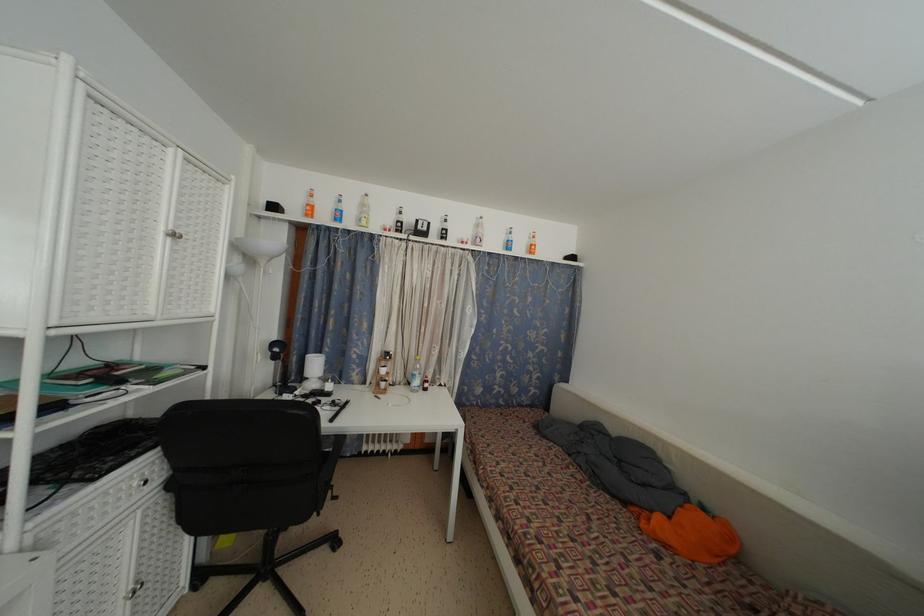
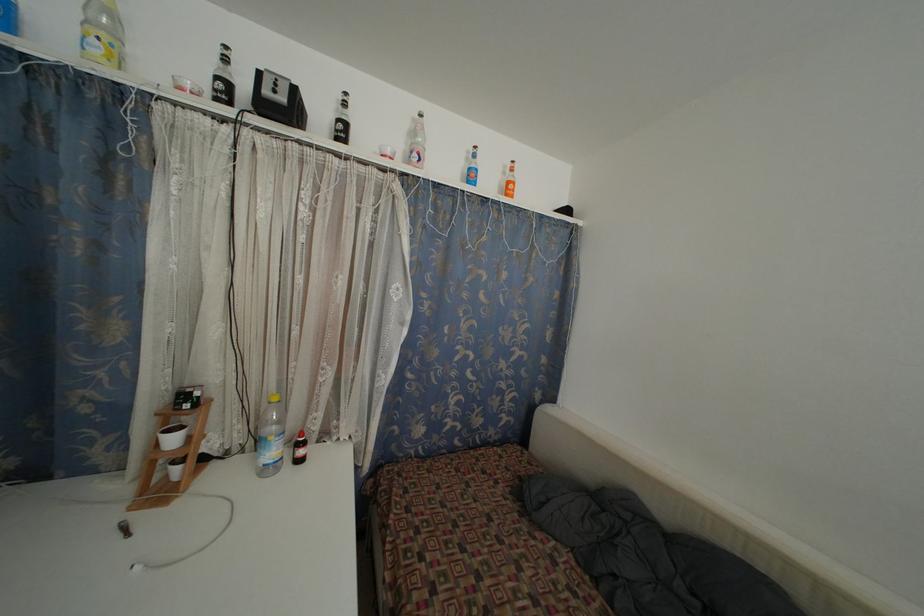
Where in the second image is the point corresponding to [536,251] from the first image?

(513, 188)